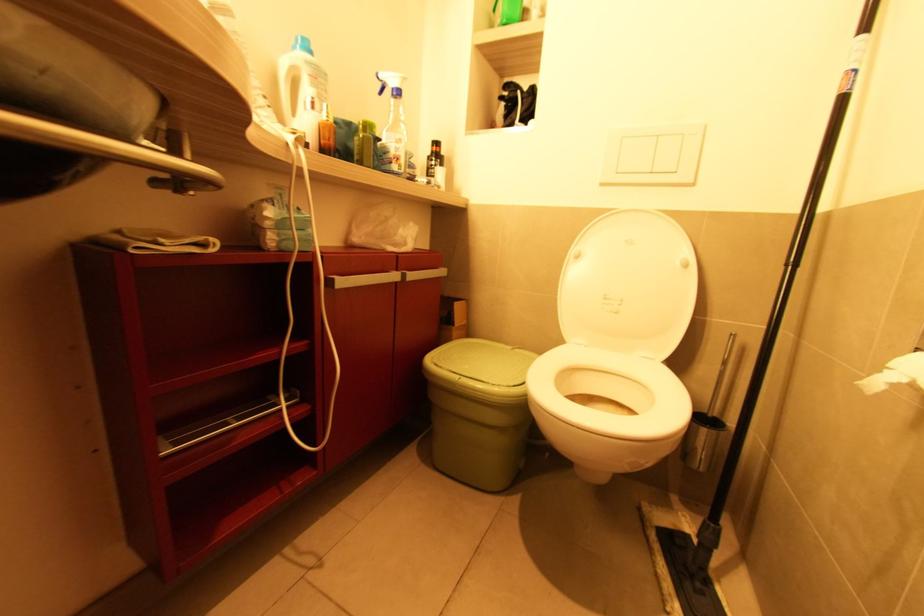
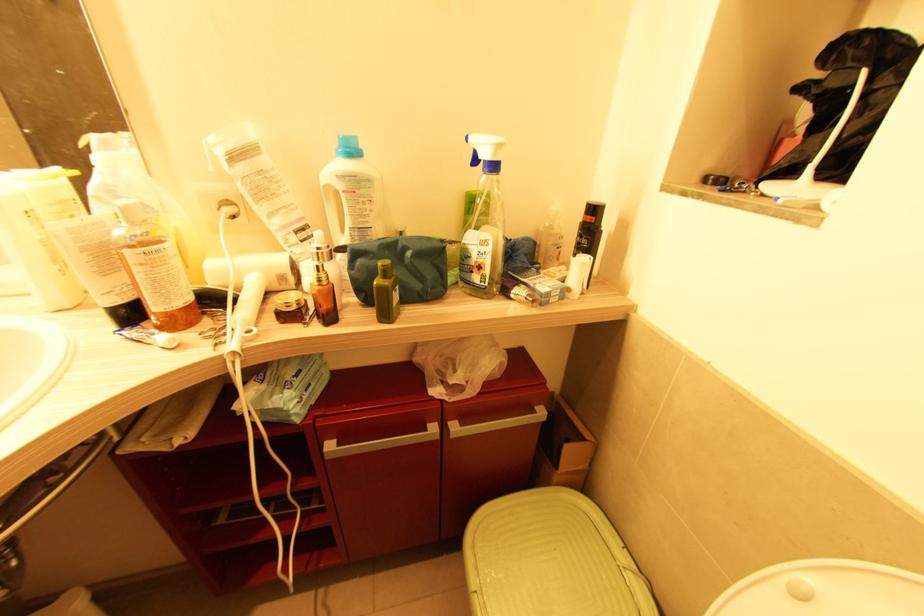
Find the pixel in the second image that matches (x=298, y=45) in the first image.

(341, 148)